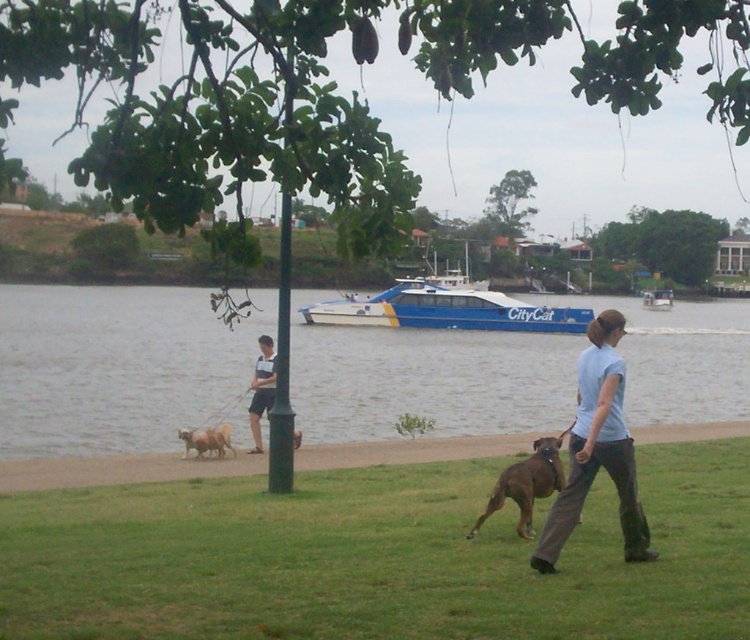
Question: Can you confirm if green grass at lower center is smaller than blue/white water at center?

Choices:
 (A) no
 (B) yes

Answer: (B)

Question: Considering the relative positions of blue/white water at center and brown leather dog at lower center in the image provided, where is blue/white water at center located with respect to brown leather dog at lower center?

Choices:
 (A) right
 (B) left

Answer: (B)

Question: Which point is closer to the camera taking this photo?

Choices:
 (A) (252, 408)
 (B) (585, 410)
 (C) (650, 298)
 (D) (528, 476)

Answer: (B)

Question: Which of the following is the closest to the observer?

Choices:
 (A) (464, 324)
 (B) (158, 515)
 (C) (666, 292)
 (D) (206, 448)

Answer: (B)

Question: Is blue/white water at center to the right of blue polished citycat at center from the viewer's perspective?

Choices:
 (A) yes
 (B) no

Answer: (B)

Question: Which object is farther from the camera taking this photo?

Choices:
 (A) green grass at lower center
 (B) blue polished citycat at center

Answer: (B)